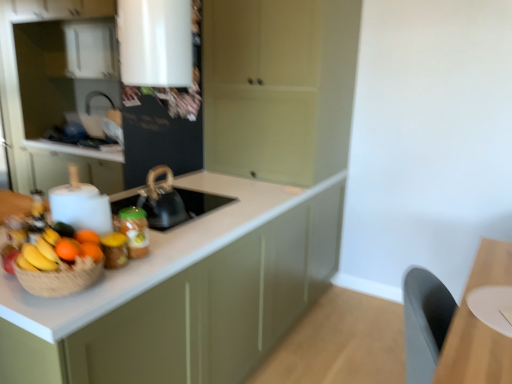
In order to click on matte white countertop at center, which appears as the 2th cabinetry when viewed from the left in this screenshot , I will do `click(185, 294)`.

The width and height of the screenshot is (512, 384). What do you see at coordinates (22, 99) in the screenshot?
I see `white matte cabinet at left, placed as the first cabinetry when sorted from left to right` at bounding box center [22, 99].

Identify the location of matte white countertop at center, arranged as the second cabinetry when viewed from the right. Image resolution: width=512 pixels, height=384 pixels. (185, 294).

Which is more to the right, orange matte at left, the first orange from the back, or black matte kettle at center?

From the viewer's perspective, black matte kettle at center appears more on the right side.

Is orange matte at left, the first orange from the back, in front of or behind black matte kettle at center in the image?

orange matte at left, the first orange from the back, is positioned closer to the viewer than black matte kettle at center.

From the image's perspective, which one is positioned lower, orange matte at left, the 3th orange when ordered from front to back, or black matte kettle at center?

orange matte at left, the 3th orange when ordered from front to back, is shown below in the image.

Is white matte cabinet at left, which ranks as the 3th cabinetry in right-to-left order, oriented away from orange matte at left, arranged as the second orange when viewed from the back?

No, orange matte at left, arranged as the second orange when viewed from the back, is not at the back of white matte cabinet at left, which ranks as the 3th cabinetry in right-to-left order.

From the image's perspective, is white matte cabinet at left, placed as the first cabinetry when sorted from left to right, under orange matte at left, the 2th orange when ordered from front to back?

No, from the image's perspective, white matte cabinet at left, placed as the first cabinetry when sorted from left to right, is not beneath orange matte at left, the 2th orange when ordered from front to back.

Is white matte cabinet at left, which ranks as the 3th cabinetry in right-to-left order, completely or partially outside of orange matte at left, the 2th orange when ordered from front to back?

Yes.

From a real-world perspective, count 2nd cabinetrys upward from the orange matte at left, the 2th orange when ordered from front to back, and point to it. Please provide its 2D coordinates.

[(22, 99)]

Is point (49, 263) less distant than point (267, 176)?

Yes.

Consider the image. Is yellow matte bananas at left oriented away from matte green cabinet at center, the third cabinetry positioned from the left?

No, yellow matte bananas at left's orientation is not away from matte green cabinet at center, the third cabinetry positioned from the left.

Consider the image. Can we say yellow matte bananas at left lies outside matte green cabinet at center, acting as the 1th cabinetry starting from the right?

That's correct, yellow matte bananas at left is outside of matte green cabinet at center, acting as the 1th cabinetry starting from the right.

Does yellow matte bananas at left touch matte green cabinet at center, the third cabinetry positioned from the left?

yellow matte bananas at left and matte green cabinet at center, the third cabinetry positioned from the left, are clearly separated.

Which of these two, orange matte at left, acting as the third orange starting from the back, or matte white countertop at center, arranged as the second cabinetry when viewed from the right, is thinner?

orange matte at left, acting as the third orange starting from the back, is thinner.

Is orange matte at left, acting as the third orange starting from the back, facing away from matte white countertop at center, which appears as the 2th cabinetry when viewed from the left?

No, orange matte at left, acting as the third orange starting from the back,'s orientation is not away from matte white countertop at center, which appears as the 2th cabinetry when viewed from the left.

From the picture: Between orange matte at left, acting as the third orange starting from the back, and matte white countertop at center, which appears as the 2th cabinetry when viewed from the left, which one appears on the right side from the viewer's perspective?

Positioned to the right is matte white countertop at center, which appears as the 2th cabinetry when viewed from the left.

From the image's perspective, is orange matte at left, the 1th orange from the front, on top of matte white countertop at center, arranged as the second cabinetry when viewed from the right?

Correct, orange matte at left, the 1th orange from the front, appears higher than matte white countertop at center, arranged as the second cabinetry when viewed from the right, in the image.

Is orange matte at left, acting as the third orange starting from the back, inside white matte cabinet at left, which ranks as the 3th cabinetry in right-to-left order?

No, orange matte at left, acting as the third orange starting from the back, is not surrounded by white matte cabinet at left, which ranks as the 3th cabinetry in right-to-left order.

Between white matte cabinet at left, placed as the first cabinetry when sorted from left to right, and orange matte at left, acting as the third orange starting from the back, which one is positioned in front?

Positioned in front is orange matte at left, acting as the third orange starting from the back.

Consider the image. Which is more to the left, white matte cabinet at left, placed as the first cabinetry when sorted from left to right, or orange matte at left, the 1th orange from the front?

Positioned to the left is white matte cabinet at left, placed as the first cabinetry when sorted from left to right.

Is white matte cabinet at left, which ranks as the 3th cabinetry in right-to-left order, wider or thinner than orange matte at left, the 1th orange from the front?

Clearly, white matte cabinet at left, which ranks as the 3th cabinetry in right-to-left order, has more width compared to orange matte at left, the 1th orange from the front.

Between translucent glass jar at center and wooden table at lower right, which one has larger width?

Wider between the two is wooden table at lower right.

Is translucent glass jar at center far from wooden table at lower right?

That's right, there is a large distance between translucent glass jar at center and wooden table at lower right.

Which point is more distant from viewer, (145,255) or (469,364)?

Point (145,255)

Is the surface of orange matte at left, acting as the third orange starting from the back, in direct contact with wooden table at lower right?

orange matte at left, acting as the third orange starting from the back, and wooden table at lower right are clearly separated.

In the scene shown: Which is closer to the camera, (73, 249) or (487, 363)?

Point (73, 249) is farther from the camera than point (487, 363).

Which of these two, orange matte at left, the 1th orange from the front, or wooden table at lower right, stands shorter?

orange matte at left, the 1th orange from the front.

Consider the image. Is orange matte at left, acting as the third orange starting from the back, to the left or to the right of wooden table at lower right in the image?

In the image, orange matte at left, acting as the third orange starting from the back, appears on the left side of wooden table at lower right.

Identify the location of sink on the right of orange matte at left, the 3th orange when ordered from front to back. The image size is (512, 384). (166, 202).

At what (x,y) coordinates should I click in order to perform the action: click on the 2nd cabinetry above when counting from the orange matte at left, arranged as the second orange when viewed from the back (from the image's perspective). Please return your answer as a coordinate pair (x, y). The image size is (512, 384). Looking at the image, I should click on (22, 99).

Based on their spatial positions, is orange matte at left, acting as the third orange starting from the back, or orange matte at left, the 3th orange when ordered from front to back, closer to translucent glass jar at center?

Among the two, orange matte at left, the 3th orange when ordered from front to back, is located nearer to translucent glass jar at center.

When comparing their distances from white matte cabinet at left, which ranks as the 3th cabinetry in right-to-left order, does matte green cabinet at center, acting as the 1th cabinetry starting from the right, or matte white countertop at center, which appears as the 2th cabinetry when viewed from the left, seem further?

matte white countertop at center, which appears as the 2th cabinetry when viewed from the left, is positioned further to the anchor white matte cabinet at left, which ranks as the 3th cabinetry in right-to-left order.

Based on their spatial positions, is matte white countertop at center, which appears as the 2th cabinetry when viewed from the left, or yellow matte bananas at left further from matte green cabinet at center, the third cabinetry positioned from the left?

yellow matte bananas at left is further to matte green cabinet at center, the third cabinetry positioned from the left.

From the image, which object appears to be farther from orange matte at left, the 2th orange when ordered from front to back, translucent glass jar at center or orange matte at left, acting as the third orange starting from the back?

translucent glass jar at center.

Estimate the real-world distances between objects in this image. Which object is further from orange matte at left, the 2th orange when ordered from front to back, matte white countertop at center, which appears as the 2th cabinetry when viewed from the left, or yellow matte bananas at left?

Among the two, matte white countertop at center, which appears as the 2th cabinetry when viewed from the left, is located further to orange matte at left, the 2th orange when ordered from front to back.

From the image, which object appears to be farther from orange matte at left, the first orange from the back, orange matte at left, the 1th orange from the front, or orange matte at left, arranged as the second orange when viewed from the back?

Among the two, orange matte at left, the 1th orange from the front, is located further to orange matte at left, the first orange from the back.

Considering their positions, is matte green cabinet at center, acting as the 1th cabinetry starting from the right, positioned further to yellow matte bananas at left than white matte cabinet at left, placed as the first cabinetry when sorted from left to right?

white matte cabinet at left, placed as the first cabinetry when sorted from left to right, lies further to yellow matte bananas at left than the other object.

Which object lies further to the anchor point orange matte at left, the first orange from the back, wooden table at lower right or matte green cabinet at center, acting as the 1th cabinetry starting from the right?

matte green cabinet at center, acting as the 1th cabinetry starting from the right, is positioned further to the anchor orange matte at left, the first orange from the back.

Find the location of a particular element. This screenshot has width=512, height=384. cabinetry located between orange matte at left, the 1th orange from the front, and matte green cabinet at center, the third cabinetry positioned from the left, in the depth direction is located at coordinates (185, 294).

Image resolution: width=512 pixels, height=384 pixels. Find the location of `kitchen appliance located between orange matte at left, the 1th orange from the front, and wooden table at lower right in the left-right direction`. kitchen appliance located between orange matte at left, the 1th orange from the front, and wooden table at lower right in the left-right direction is located at coordinates (135, 231).

Find the location of a particular element. The width and height of the screenshot is (512, 384). sink located between translucent glass jar at center and white matte cabinet at left, placed as the first cabinetry when sorted from left to right, in the depth direction is located at coordinates (166, 202).

Locate an element on the screen. The width and height of the screenshot is (512, 384). orange between orange matte at left, the 2th orange when ordered from front to back, and white matte cabinet at left, placed as the first cabinetry when sorted from left to right, in the front-back direction is located at coordinates (87, 236).